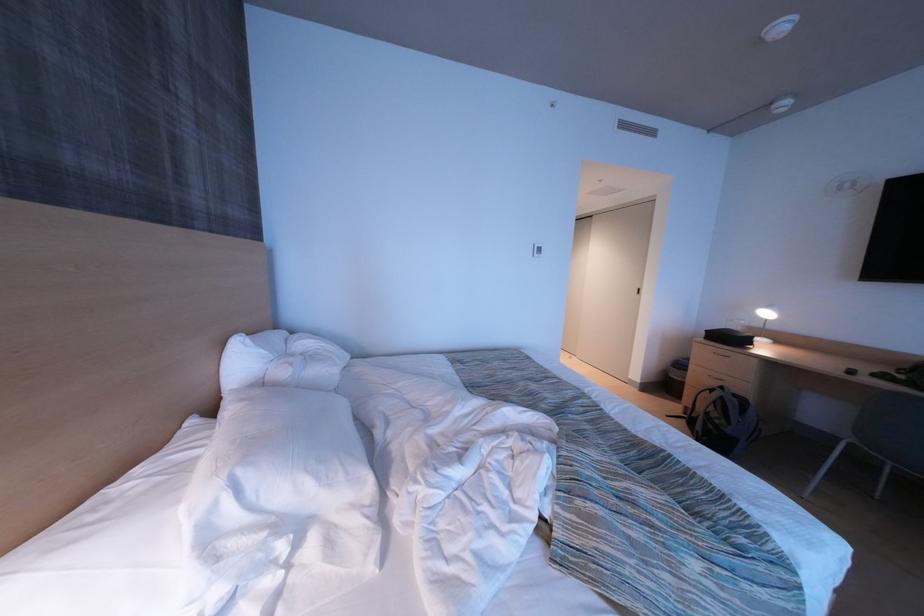
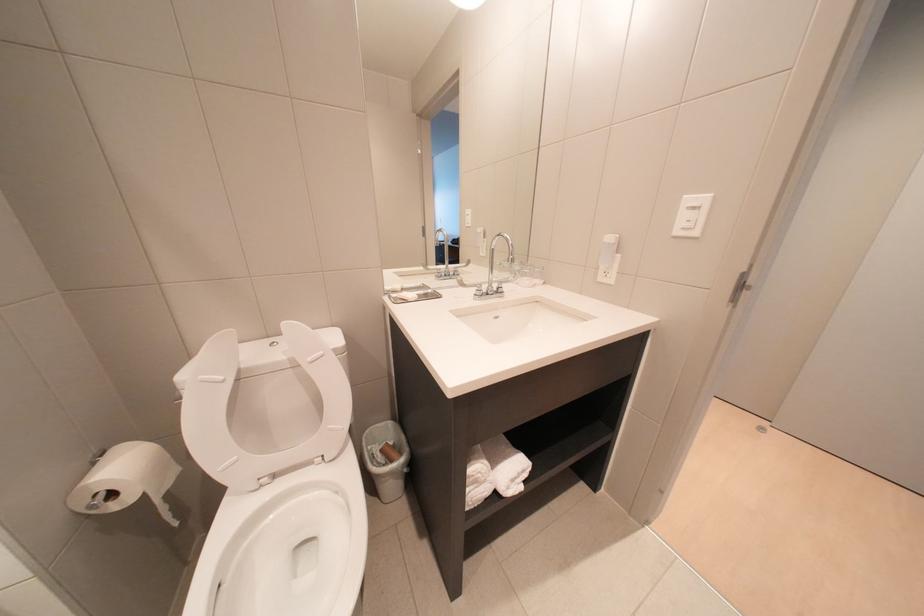
Question: What movement of the cameraman would produce the second image?

Choices:
 (A) Left
 (B) Right
 (C) Forward
 (D) Backward

Answer: (C)